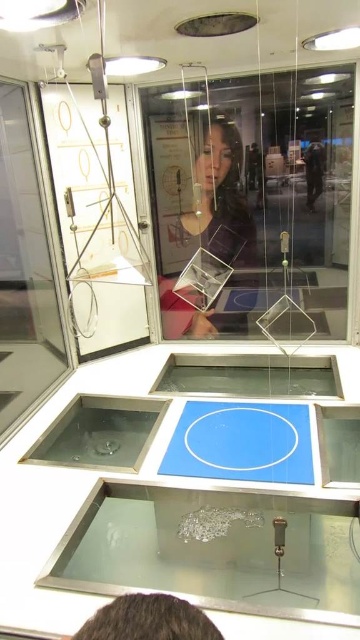
You are standing in front of an interactive exhibit with transparent glass at lower center and a matte glass cube at center. Which object is nearer to you?

The transparent glass at lower center is closer to the viewer than the matte glass cube at center, so the transparent glass at lower center is nearer to you.

You are an engineer designing a new exhibit. You need to place a decorative plaque between the transparent glass at lower center and the matte glass cube at center. Which object should the plaque be placed closer to based on their widths?

The plaque should be placed closer to the transparent glass at lower center because its width is greater than the matte glass cube at center, so positioning the plaque near the wider object would balance the exhibit layout.